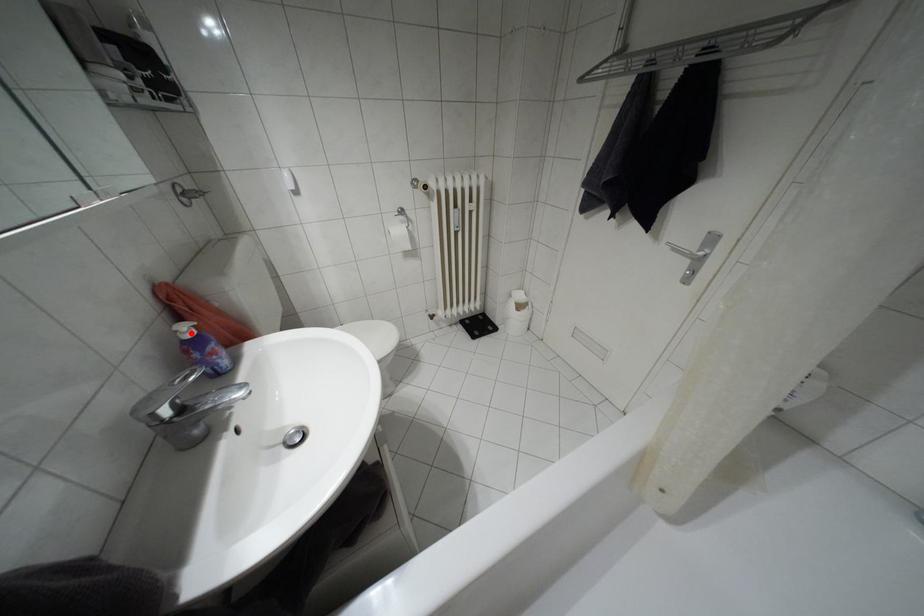
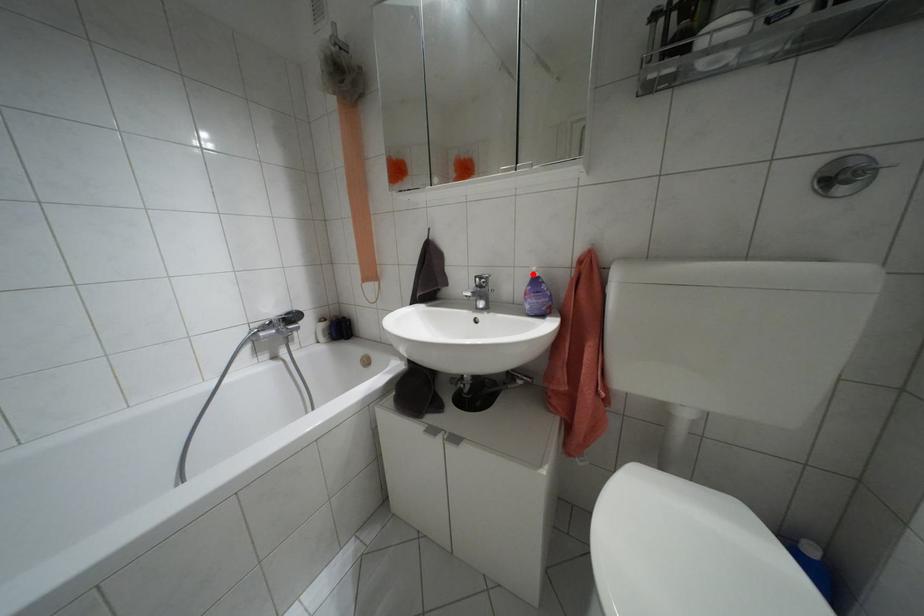
I am providing you with two images of the same scene from different viewpoints. A red point is marked on the first image and another point is marked on the second image. Is the marked point in image1 the same physical position as the marked point in image2?

Yes